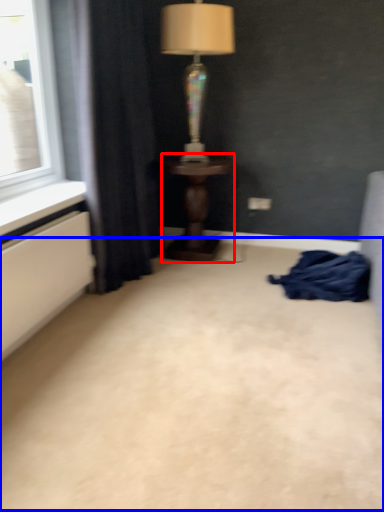
Question: Which object appears farthest to the camera in this image, table (highlighted by a red box) or plain (highlighted by a blue box)?

Choices:
 (A) table
 (B) plain

Answer: (A)